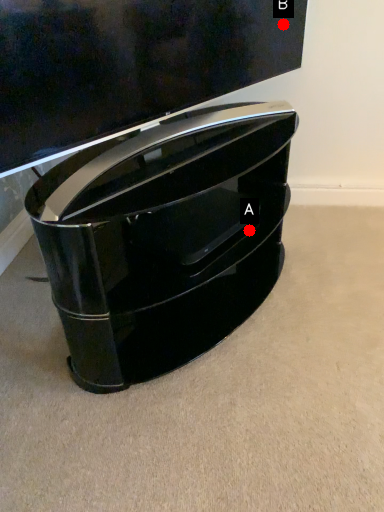
Question: Two points are circled on the image, labeled by A and B beside each circle. Which point is closer to the camera?

Choices:
 (A) A is closer
 (B) B is closer

Answer: (A)